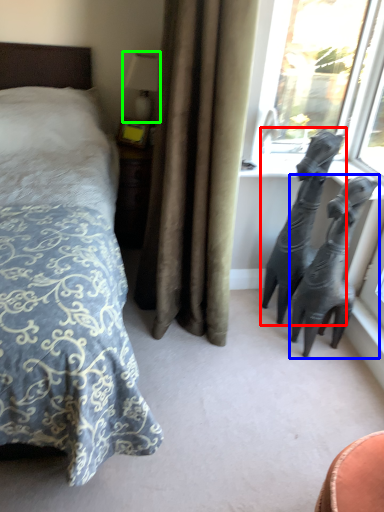
Question: Estimate the real-world distances between objects in this image. Which object is farther from animal (highlighted by a red box), bronze sculpture (highlighted by a blue box) or table lamp (highlighted by a green box)?

Choices:
 (A) bronze sculpture
 (B) table lamp

Answer: (B)